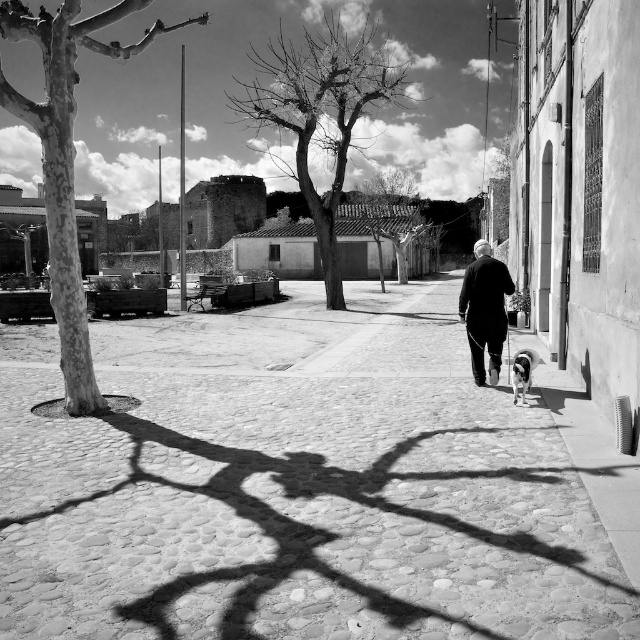
You are standing on the sidewalk on the right side of the cobblestone street. You see the smooth bark tree at left and the white fur dog at lower right. Which object is closer to you?

The smooth bark tree at left is closer to you because it is in front of the white fur dog at lower right.

You are standing at the point with coordinates point (524, 362) and want to walk towards the point with coordinates point (429, 556). Given the scene described, will you be moving towards the foreground or the background of the image?

Moving from point (524, 362) to point (429, 556) would be moving towards the foreground of the image since point (429, 556) is in front of point (524, 362).